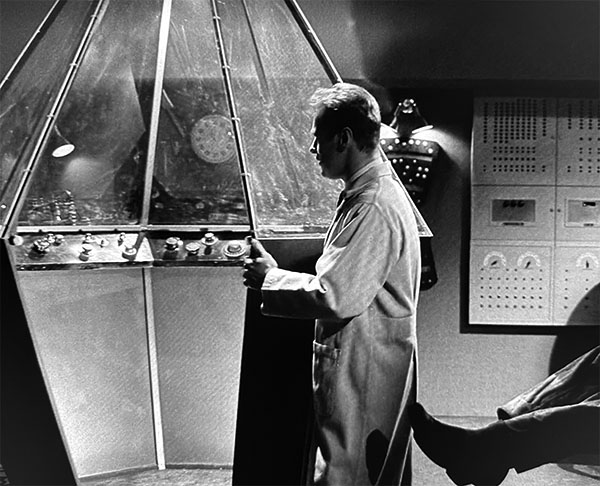
I want to click on laboraory, so click(x=213, y=102).